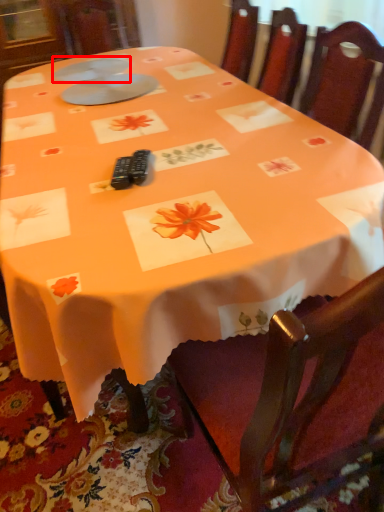
Question: From the image's perspective, what is the correct spatial relationship of tableware (annotated by the red box) in relation to tableware?

Choices:
 (A) above
 (B) below

Answer: (A)